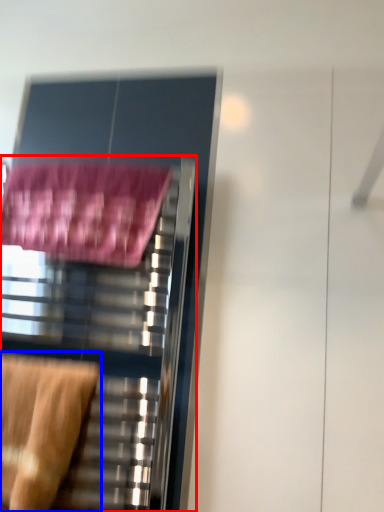
Question: Which object appears farthest to the camera in this image, furniture (highlighted by a red box) or swivel chair (highlighted by a blue box)?

Choices:
 (A) furniture
 (B) swivel chair

Answer: (A)